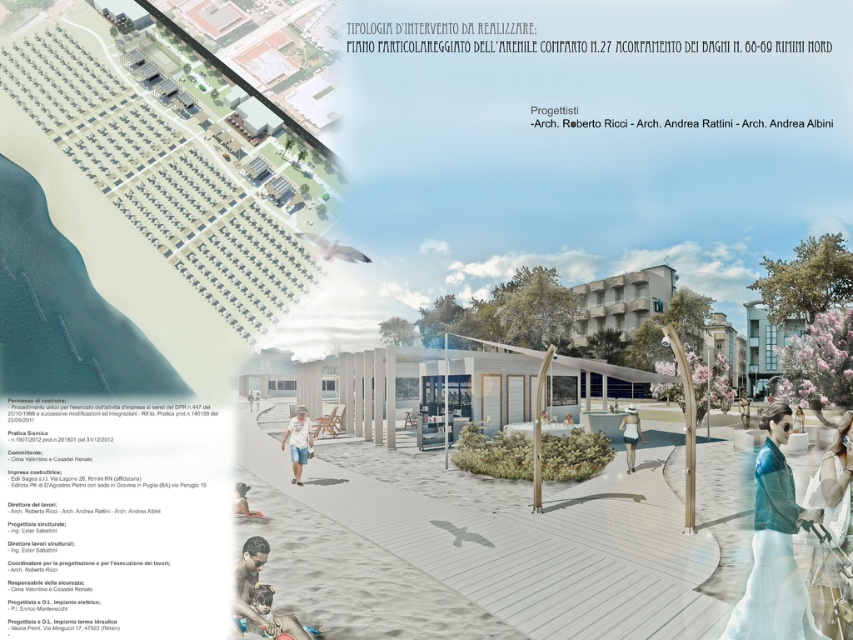
Question: Does denim jacket at lower right have a larger size compared to white matte swimsuit at center?

Choices:
 (A) no
 (B) yes

Answer: (A)

Question: Does matte white sand at lower center appear on the left side of white fabric umbrella at center?

Choices:
 (A) yes
 (B) no

Answer: (A)

Question: Which of the following is the farthest from the observer?

Choices:
 (A) white plastic chair at center
 (B) white wood person at center
 (C) watercolor skin at lower left
 (D) white cotton dress at lower right

Answer: (A)

Question: Can you confirm if white cotton dress at lower right is smaller than white matte swimsuit at center?

Choices:
 (A) yes
 (B) no

Answer: (A)

Question: Which is nearer to the denim jacket at lower right?

Choices:
 (A) watercolor skin at lower left
 (B) white cotton t-shirt at center

Answer: (A)

Question: Which point appears closest to the camera in this image?

Choices:
 (A) (572, 416)
 (B) (746, 413)
 (C) (544, 419)

Answer: (C)